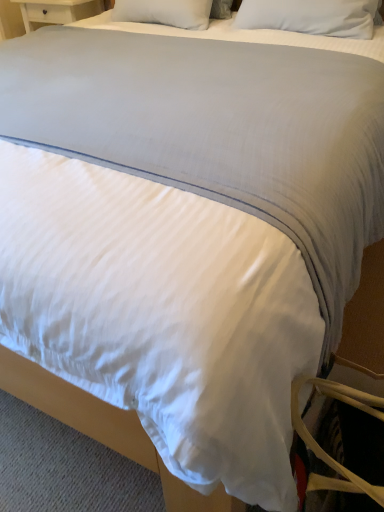
Question: Is tan leather swivel chair at lower right not close to white soft pillow at upper center, the second pillow viewed from the left?

Choices:
 (A) no
 (B) yes

Answer: (B)

Question: Is tan leather swivel chair at lower right positioned in front of white soft pillow at upper center, the second pillow viewed from the left?

Choices:
 (A) no
 (B) yes

Answer: (B)

Question: Is the depth of tan leather swivel chair at lower right greater than that of white soft pillow at upper center, which ranks as the 1th pillow in right-to-left order?

Choices:
 (A) no
 (B) yes

Answer: (A)

Question: Is tan leather swivel chair at lower right oriented towards white soft pillow at upper center, the second pillow viewed from the left?

Choices:
 (A) no
 (B) yes

Answer: (B)

Question: Is white soft pillow at upper center, which ranks as the 1th pillow in right-to-left order, inside tan leather swivel chair at lower right?

Choices:
 (A) yes
 (B) no

Answer: (B)

Question: Is white soft pillow at upper center, which ranks as the 1th pillow in right-to-left order, taller or shorter than tan leather swivel chair at lower right?

Choices:
 (A) tall
 (B) short

Answer: (B)

Question: In the image, is white soft pillow at upper center, which ranks as the 1th pillow in right-to-left order, positioned in front of or behind tan leather swivel chair at lower right?

Choices:
 (A) behind
 (B) front

Answer: (A)

Question: Choose the correct answer: Is white soft pillow at upper center, which ranks as the 1th pillow in right-to-left order, inside tan leather swivel chair at lower right or outside it?

Choices:
 (A) outside
 (B) inside

Answer: (A)

Question: From the image's perspective, relative to tan leather swivel chair at lower right, is white soft pillow at upper center, the second pillow viewed from the left, above or below?

Choices:
 (A) above
 (B) below

Answer: (A)

Question: Looking at the image, does tan leather swivel chair at lower right seem bigger or smaller compared to white soft pillow at upper center, the second pillow positioned from the right?

Choices:
 (A) small
 (B) big

Answer: (B)

Question: Visually, is tan leather swivel chair at lower right positioned to the left or to the right of white soft pillow at upper center, placed as the first pillow when sorted from left to right?

Choices:
 (A) left
 (B) right

Answer: (B)

Question: Which is correct: tan leather swivel chair at lower right is inside white soft pillow at upper center, placed as the first pillow when sorted from left to right, or outside of it?

Choices:
 (A) outside
 (B) inside

Answer: (A)

Question: From the image's perspective, is tan leather swivel chair at lower right located above or below white soft pillow at upper center, the second pillow positioned from the right?

Choices:
 (A) above
 (B) below

Answer: (B)

Question: Does point (297, 429) appear closer or farther from the camera than point (304, 22)?

Choices:
 (A) farther
 (B) closer

Answer: (B)

Question: From a real-world perspective, is tan leather swivel chair at lower right positioned above or below white soft pillow at upper center, the second pillow viewed from the left?

Choices:
 (A) below
 (B) above

Answer: (A)